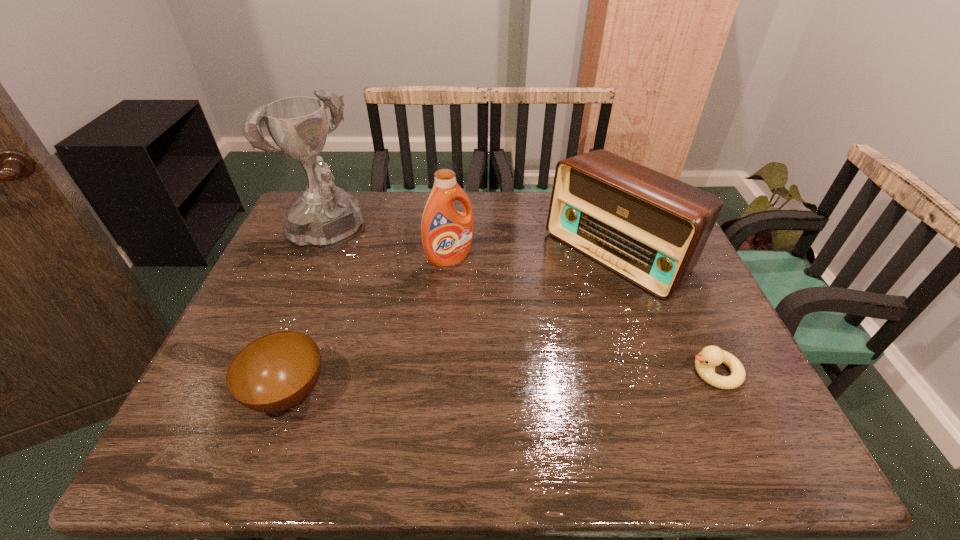
Image resolution: width=960 pixels, height=540 pixels. I want to click on vacant space that satisfies the following two spatial constraints: 1. on the front side of the duckling; 2. at the beak of the award, so point(268,372).